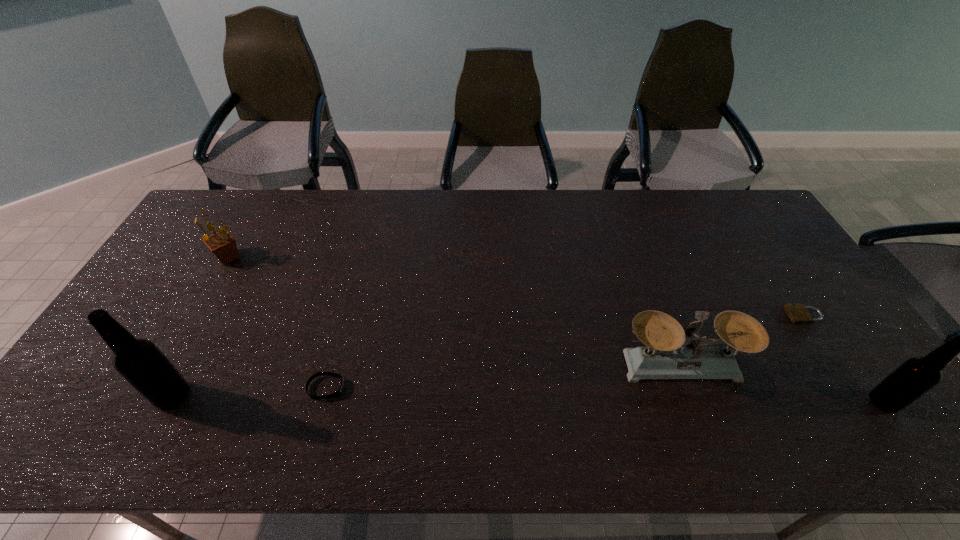
The width and height of the screenshot is (960, 540). Find the location of `the left beer bottle`. the left beer bottle is located at coordinates (140, 362).

Locate an element on the screen. This screenshot has width=960, height=540. the taller beer bottle is located at coordinates (140, 362).

You are a GUI agent. You are given a task and a screenshot of the screen. Output one action in this format:
    pyautogui.click(x=<x>, y=<y>)
    Task: Click on the right beer bottle
    The width and height of the screenshot is (960, 540).
    Given the screenshot: What is the action you would take?
    pyautogui.click(x=916, y=376)

Where is `the shorter beer bottle`? the shorter beer bottle is located at coordinates (916, 376).

Where is `sunflower`? Image resolution: width=960 pixels, height=540 pixels. sunflower is located at coordinates (222, 244).

Where is `the second farthest object`? Image resolution: width=960 pixels, height=540 pixels. the second farthest object is located at coordinates (797, 312).

Find the location of a particular element. This screenshot has height=540, width=960. wristband is located at coordinates (339, 391).

Identify the location of the fourth object from left to right. (664, 357).

Find the location of a particular element. This screenshot has height=540, width=960. vacant space located on the right of the taller beer bottle is located at coordinates (224, 396).

You are a GUI agent. You are given a task and a screenshot of the screen. Output one action in this format:
    pyautogui.click(x=<x>, y=<y>)
    Task: Click on the free location located on the left of the right beer bottle
    
    Given the screenshot: What is the action you would take?
    pyautogui.click(x=782, y=402)